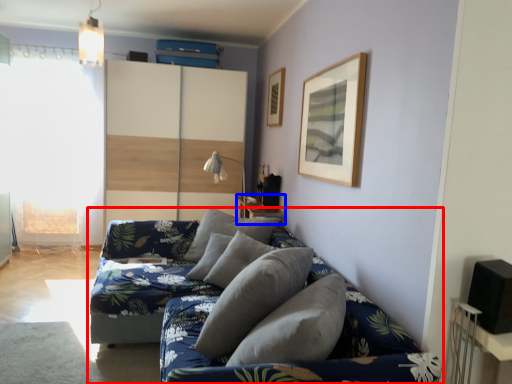
Question: Among these objects, which one is nearest to the camera, studio couch (highlighted by a red box) or table (highlighted by a blue box)?

Choices:
 (A) studio couch
 (B) table

Answer: (A)